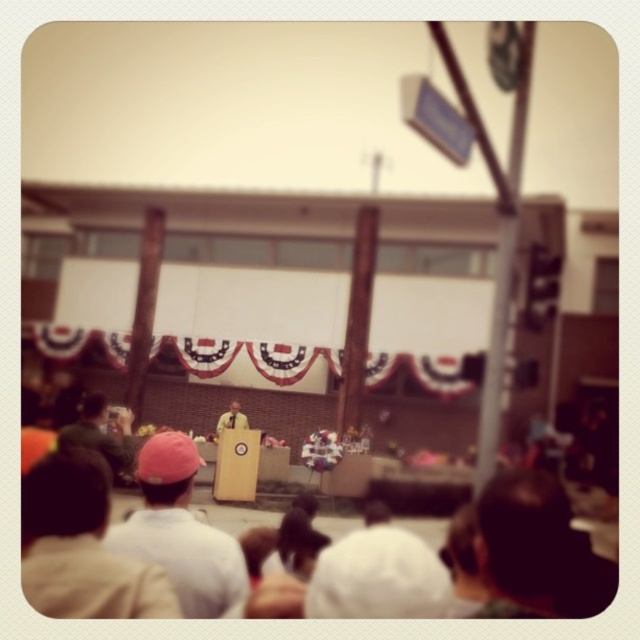
Consider the image. Is white cotton shirt at lower left shorter than white matte cap at lower left?

Yes, white cotton shirt at lower left is shorter than white matte cap at lower left.

This screenshot has height=640, width=640. Describe the element at coordinates (81, 547) in the screenshot. I see `white cotton shirt at lower left` at that location.

You are a GUI agent. You are given a task and a screenshot of the screen. Output one action in this format:
    pyautogui.click(x=<x>, y=<y>)
    Task: Click on the white cotton shirt at lower left
    
    Given the screenshot: What is the action you would take?
    pyautogui.click(x=81, y=547)

Does point (508, 504) come farther from viewer compared to point (113, 460)?

No.

Can you confirm if dark brown leather hat at lower right is positioned below khaki cotton shirt at lower left?

Yes, dark brown leather hat at lower right is below khaki cotton shirt at lower left.

Is point (605, 570) closer to viewer compared to point (84, 417)?

Yes.

Identify the location of dark brown leather hat at lower right. (536, 552).

Does dark brown leather hat at lower right have a greater width compared to yellow fabric at center?

Yes.

This screenshot has height=640, width=640. I want to click on dark brown leather hat at lower right, so click(536, 552).

Where is `dark brown leather hat at lower right`? This screenshot has height=640, width=640. dark brown leather hat at lower right is located at coordinates (536, 552).

At what (x,y) coordinates should I click in order to perform the action: click on dark brown leather hat at lower right. Please return your answer as a coordinate pair (x, y). Looking at the image, I should click on (536, 552).